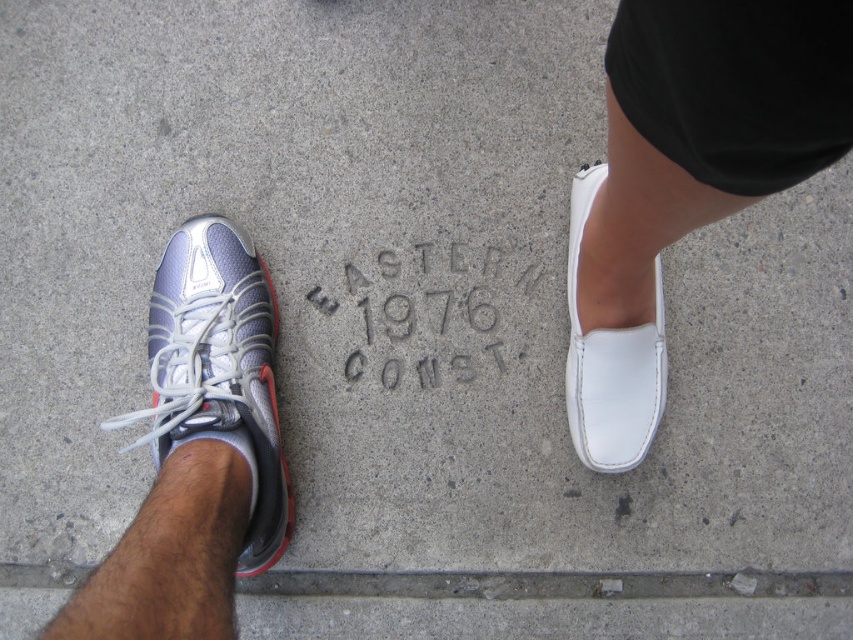
You are trying to decide which shoe to wear for a hike. Considering the height of the white leather shoe at right and the silver mesh sneaker at left, which one would provide better ankle support?

The silver mesh sneaker at left has a greater height than the white leather shoe at right, so it would provide better ankle support.